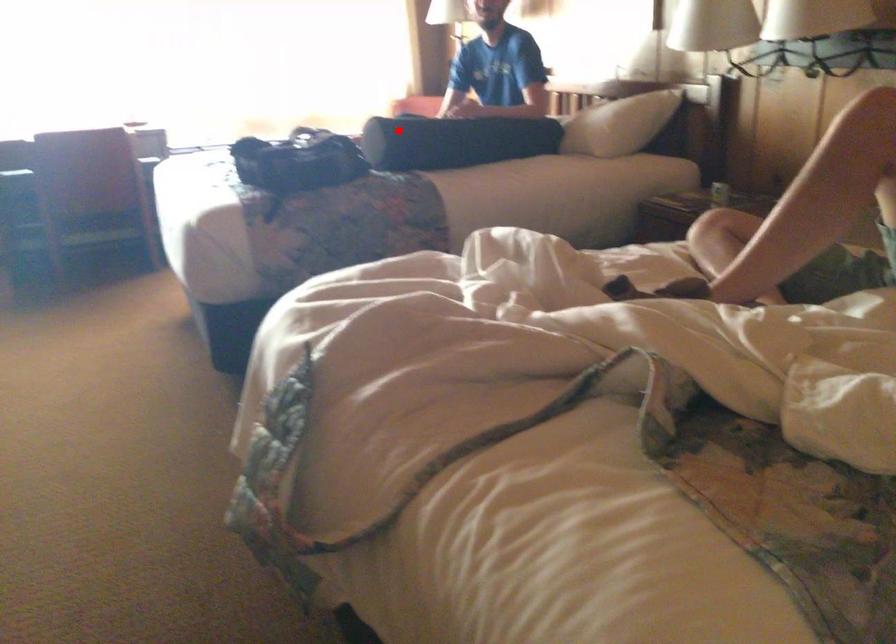
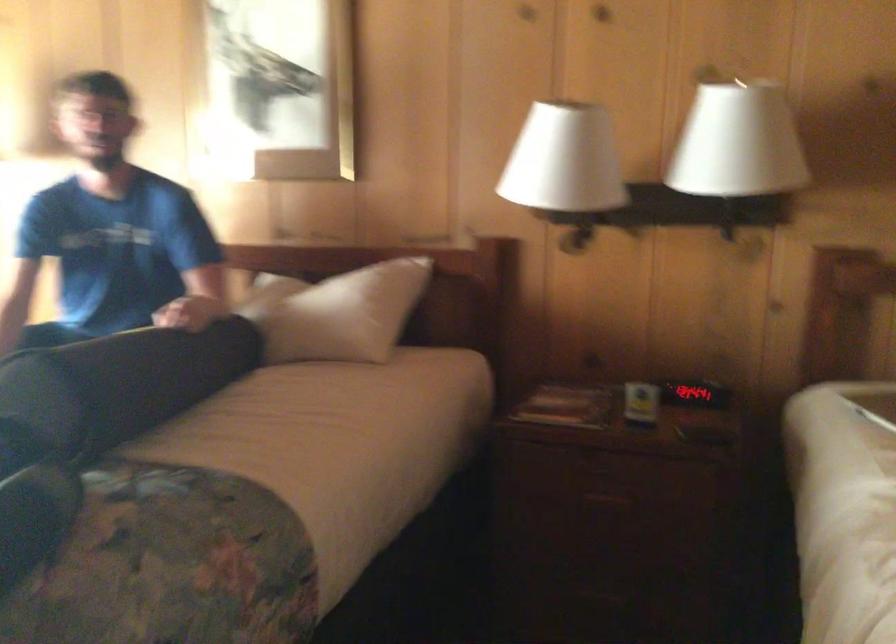
Locate, in the second image, the point that corresponds to the highlighted location in the first image.

(122, 383)